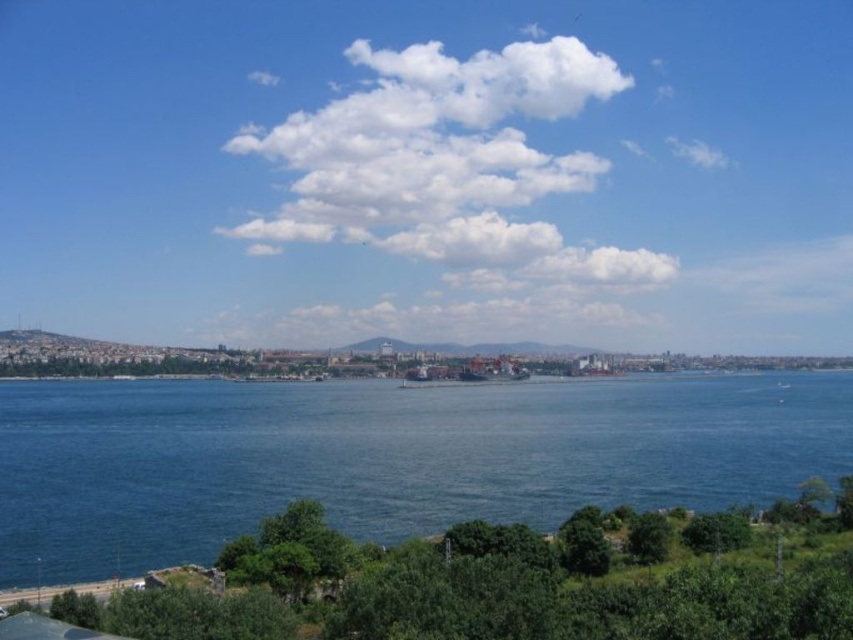
Question: Can you confirm if blue liquid water at lower center is wider than white fluffy cloud at upper center?

Choices:
 (A) no
 (B) yes

Answer: (B)

Question: Does blue liquid water at lower center have a smaller size compared to white fluffy cloud at upper center?

Choices:
 (A) yes
 (B) no

Answer: (A)

Question: Which of the following is the farthest from the observer?

Choices:
 (A) white fluffy cloud at upper center
 (B) blue liquid water at lower center

Answer: (A)

Question: Which point is farther from the camera taking this photo?

Choices:
 (A) (96, 408)
 (B) (486, 88)

Answer: (B)

Question: Is blue liquid water at lower center below white fluffy cloud at upper center?

Choices:
 (A) no
 (B) yes

Answer: (B)